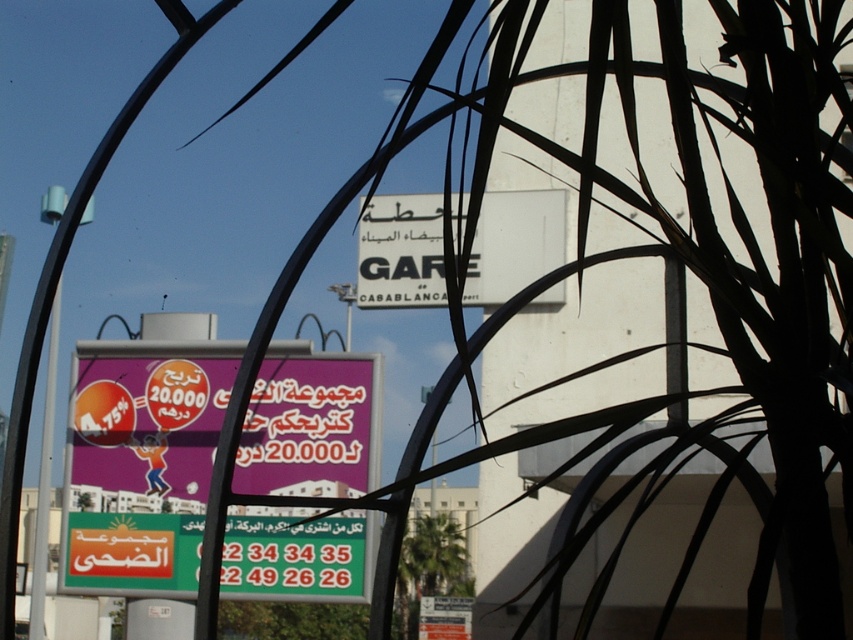
You are a delivery driver who needs to navigate through the area shown in the image. You see a purple glossy signboard at center and a white matte sign at center. Which sign should you look up to see the discount percentage mentioned in the scene?

The purple glossy signboard at center is much taller than the white matte sign at center, so you should look up to the purple glossy signboard at center to see the discount percentage mentioned in the scene.

You are standing in front of the palm tree silhouette and want to locate the purple glossy signboard at center. According to the coordinates provided, where exactly is it positioned?

The purple glossy signboard at center is located at the 2D coordinates point (141,461).

You are a tourist holding a camera and want to take a photo of both the purple glossy signboard at center and the white matte sign at center. Since you want both signs to be clearly visible, which one should you focus on to ensure the other is also in focus?

You should focus on the purple glossy signboard at center because it is closer to the viewer than the white matte sign at center. By focusing on the closer object, the depth of field may include both signs in focus.